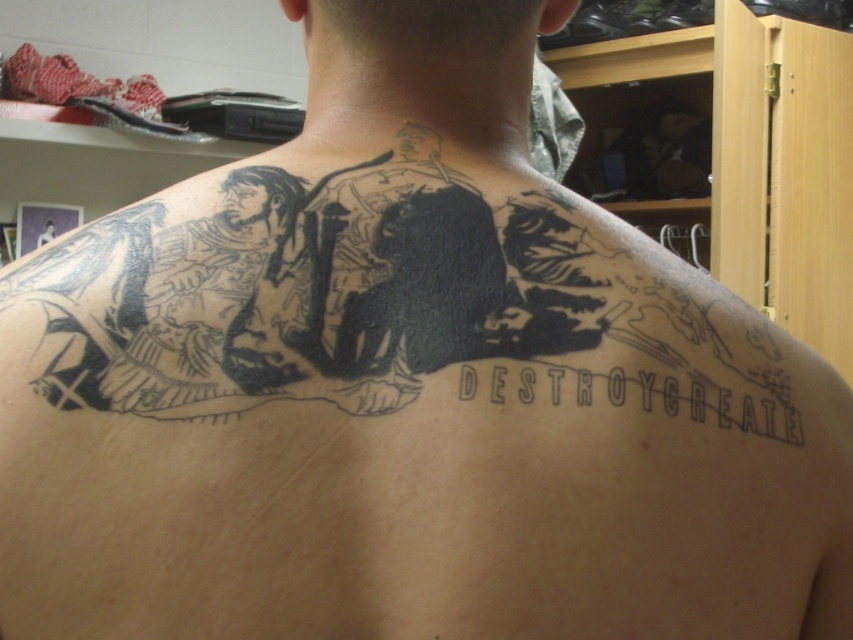
You are an artist trying to replicate this tattoo. You need to determine which of the two points, point (300,381) or point (740,397), is closer to the viewer to ensure proper perspective. Which point is closer?

Point (300,381) is closer to the viewer than point (740,397).

You are a tattoo artist measuring the distance between your client and the mirror to ensure proper alignment for a large back tattoo. The client is standing 40 centimeters away from the mirror. If the black ink tattoo at upper center is exactly where you need to work, is the client positioned correctly?

The black ink tattoo at upper center and viewer are 39.85 centimeters apart, which is just under 40 centimeters. This slight difference might affect alignment, so adjusting the client to be precisely 40 cm away would ensure accuracy during the tattooing process.